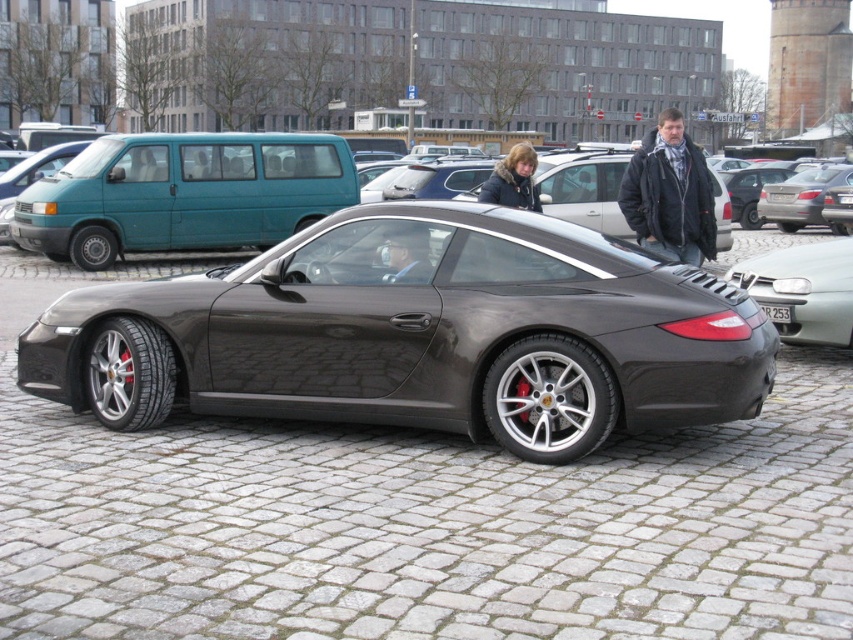
You are standing in front of a Porsche sports car parked on a cobblestone surface. You notice a specific point marked at coordinates point (550, 339). If you want to touch this point without moving your feet, can you reach it?

The point (550, 339) is 4.97 meters away from the viewer. Since the average human arm length is about 0.7 meters, you cannot reach it without moving your feet.

You are a photographer trying to capture the shiny metallic car at center and the dark gray leather jacket at upper right in the same frame. Since the car is wider than the jacket, will you need to adjust your camera angle to include both subjects?

The shiny metallic car at center is wider than the dark gray leather jacket at upper right. To capture both in the same frame, you may need to adjust your camera angle or position to accommodate the car and jacket.